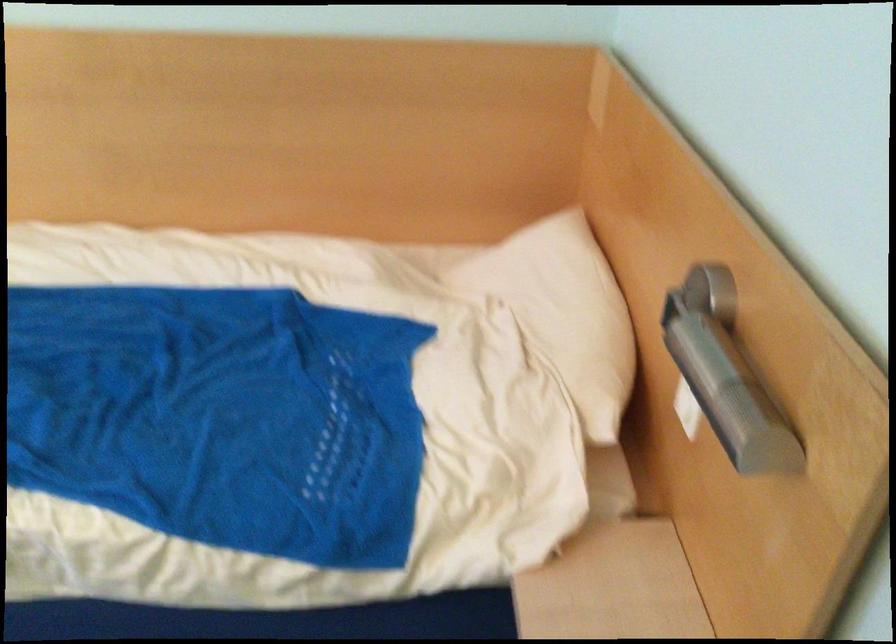
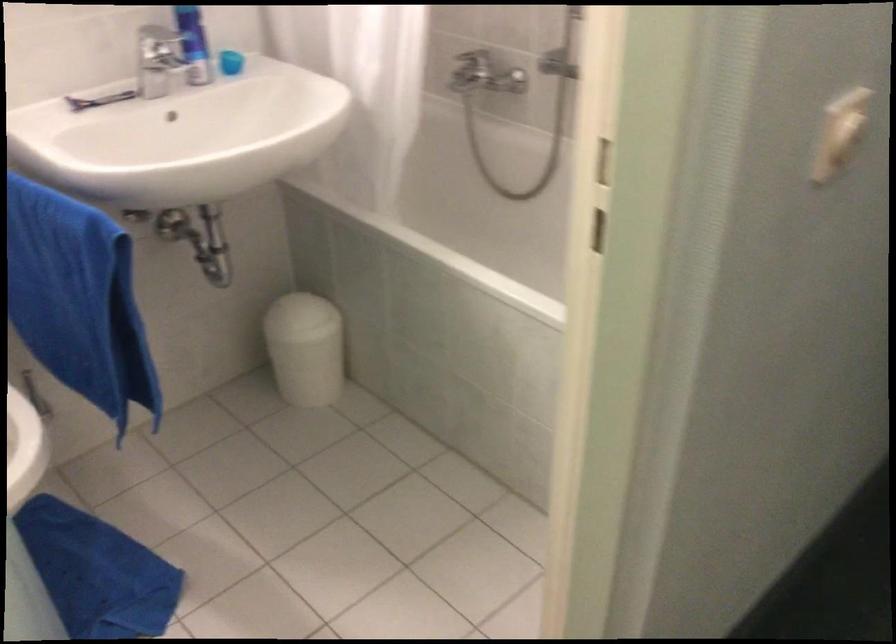
Question: The first image is from the beginning of the video and the second image is from the end. How did the camera likely rotate when shooting the video?

Choices:
 (A) Left
 (B) Right
 (C) Up
 (D) Down

Answer: (B)